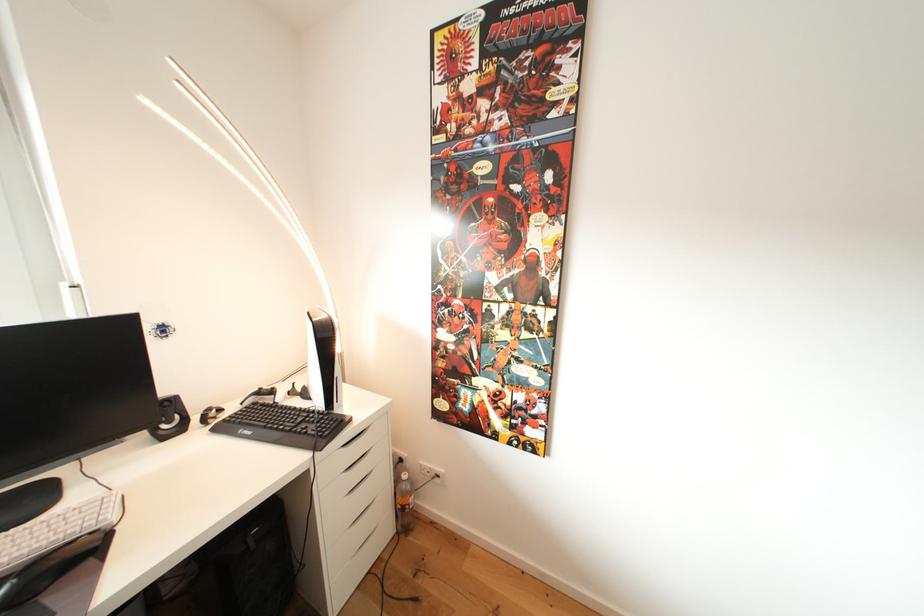
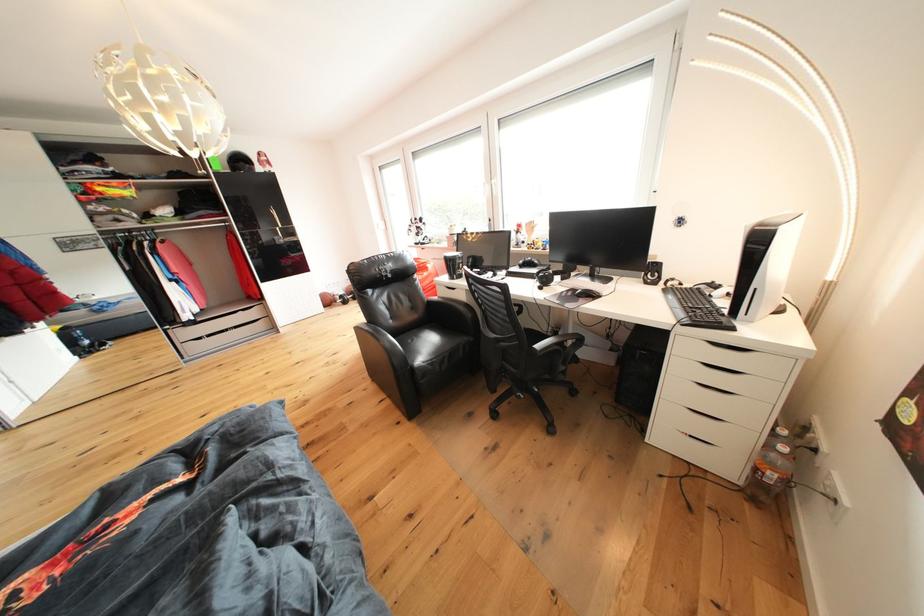
In the scene shown: The first image is from the beginning of the video and the second image is from the end. How did the camera likely rotate when shooting the video?

The camera rotated toward left-down.